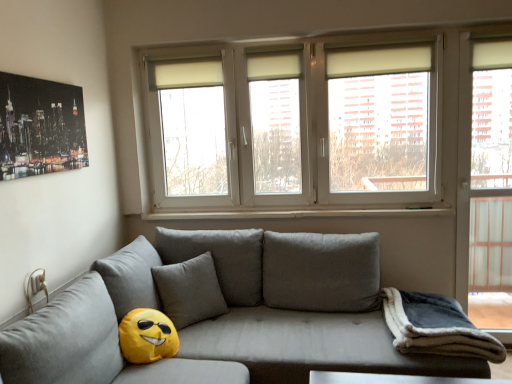
Question: Is white plastic window sill at center located outside white plastic window at upper center?

Choices:
 (A) yes
 (B) no

Answer: (B)

Question: Is white plastic window sill at center further to camera compared to white plastic window at upper center?

Choices:
 (A) no
 (B) yes

Answer: (B)

Question: From a real-world perspective, is white plastic window sill at center beneath white plastic window at upper center?

Choices:
 (A) no
 (B) yes

Answer: (B)

Question: Does white plastic window sill at center appear on the left side of white plastic window at upper center?

Choices:
 (A) no
 (B) yes

Answer: (B)

Question: Is white plastic window sill at center far from white plastic window at upper center?

Choices:
 (A) no
 (B) yes

Answer: (A)

Question: Based on their sizes in the image, would you say dark gray fleece blanket at lower right is bigger or smaller than shiny metallic poster at upper left?

Choices:
 (A) big
 (B) small

Answer: (A)

Question: From a real-world perspective, is dark gray fleece blanket at lower right above or below shiny metallic poster at upper left?

Choices:
 (A) above
 (B) below

Answer: (B)

Question: Does point (391, 312) appear closer or farther from the camera than point (10, 89)?

Choices:
 (A) farther
 (B) closer

Answer: (A)

Question: Looking at their shapes, would you say dark gray fleece blanket at lower right is wider or thinner than shiny metallic poster at upper left?

Choices:
 (A) thin
 (B) wide

Answer: (B)

Question: From the image's perspective, is white plastic window at upper center positioned above or below white plastic window sill at center?

Choices:
 (A) above
 (B) below

Answer: (A)

Question: Considering the positions of white plastic window at upper center and white plastic window sill at center in the image, is white plastic window at upper center taller or shorter than white plastic window sill at center?

Choices:
 (A) short
 (B) tall

Answer: (B)

Question: From a real-world perspective, is white plastic window at upper center above or below white plastic window sill at center?

Choices:
 (A) below
 (B) above

Answer: (B)

Question: In the image, is white plastic window at upper center positioned in front of or behind white plastic window sill at center?

Choices:
 (A) behind
 (B) front

Answer: (B)

Question: Is point (483, 39) closer or farther from the camera than point (340, 213)?

Choices:
 (A) farther
 (B) closer

Answer: (B)

Question: From a real-world perspective, is transparent glass door at right positioned above or below white plastic window sill at center?

Choices:
 (A) below
 (B) above

Answer: (B)